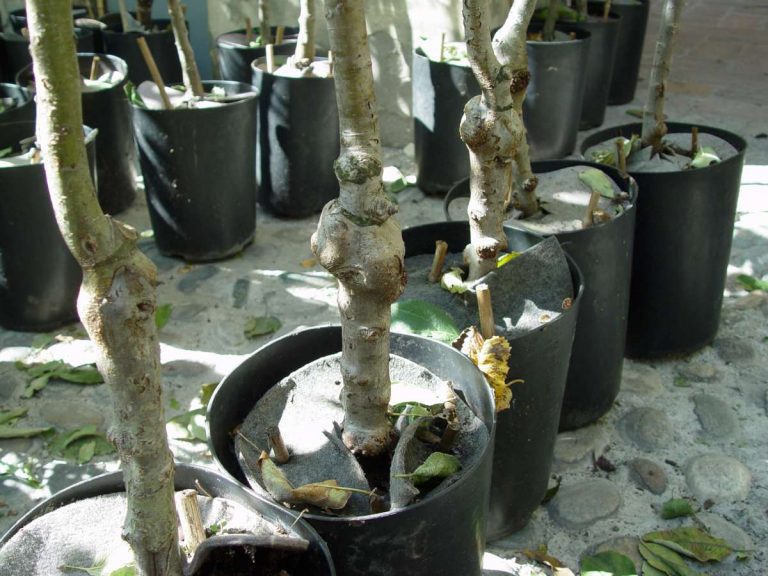
At what (x,y) coordinates should I click in order to perform the action: click on plant. Please return your answer as a coordinate pair (x, y). This screenshot has height=576, width=768. Looking at the image, I should click on (371, 466).